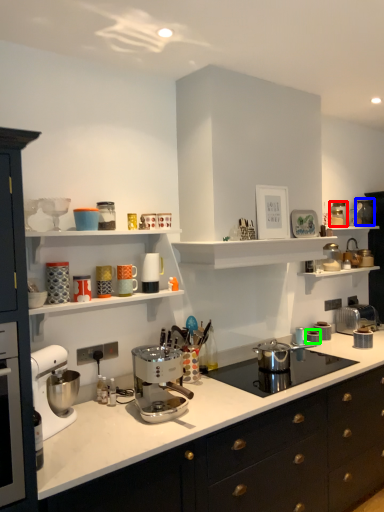
Question: Which is nearer to the kitchen appliance (highlighted by a red box)? appliance (highlighted by a blue box) or appliance (highlighted by a green box).

Choices:
 (A) appliance
 (B) appliance

Answer: (A)